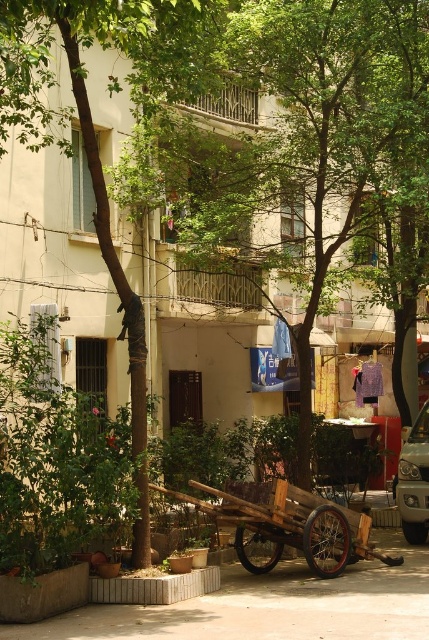
You are standing in the courtyard and want to place a small potted plant between the two points, point (199,204) and point (156,490). Which point should you place it closer to if you want the plant to be closer to the camera?

You should place the potted plant closer to point (156,490) because it is closer to the camera than point (199,204). Since point (199,204) is further away, placing the plant near point (156,490) will make it closer to the camera.

You are a delivery person who needs to park your wooden cart at center in this courtyard. There is a green leafy tree at center nearby. Considering the space they occupy, which object would require more area to accommodate?

The wooden cart at center requires more space because it occupies more area than the green leafy tree at center.

You are standing in the courtyard and want to place a small table on the paved ground. The table needs to be placed in an area that is shaded by the green leafy tree at center but not directly under the wooden cart at center. Where should you place the table?

You should place the table under the green leafy tree at center but away from the wooden cart at center since the tree is positioned over the cart, creating shade, and the area not directly under the cart would still be shaded but not obstructed by it.